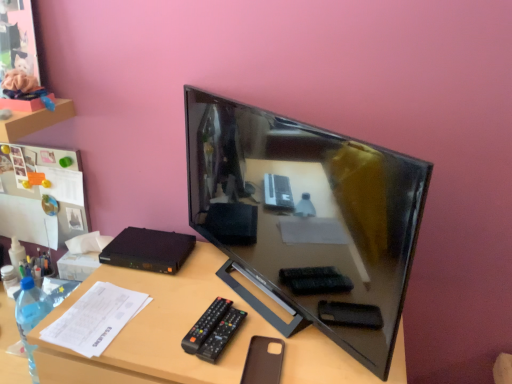
Where is `vacant point above white paper at lower left (from a real-world perspective)`? vacant point above white paper at lower left (from a real-world perspective) is located at coordinates (97, 308).